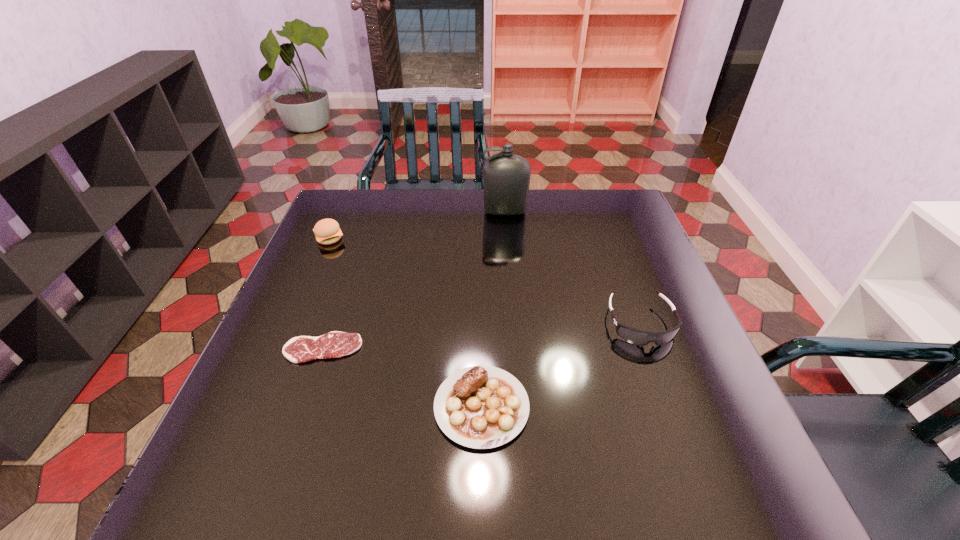
The height and width of the screenshot is (540, 960). I want to click on vacant space positioned 0.090m on the front of the hamburger, so 317,269.

This screenshot has width=960, height=540. I want to click on vacant space located 0.230m on the front and sides of the goggles, so click(687, 448).

Find the location of `blank space located on the left of the second shortest object`. blank space located on the left of the second shortest object is located at coordinates (328, 407).

This screenshot has height=540, width=960. In order to click on free point located 0.240m on the front of the farther steak in this screenshot , I will do `click(279, 475)`.

Image resolution: width=960 pixels, height=540 pixels. I want to click on bottle located at the far edge, so click(x=506, y=177).

Identify the location of hamburger situated at the far edge. This screenshot has height=540, width=960. (327, 231).

The image size is (960, 540). What are the coordinates of `hamburger that is at the left edge` in the screenshot? It's located at (327, 231).

At what (x,y) coordinates should I click in order to perform the action: click on steak that is at the left edge. Please return your answer as a coordinate pair (x, y). The width and height of the screenshot is (960, 540). Looking at the image, I should click on (335, 344).

You are a GUI agent. You are given a task and a screenshot of the screen. Output one action in this format:
    pyautogui.click(x=<x>, y=<y>)
    Task: Click on the object positioned at the right edge
    
    Given the screenshot: What is the action you would take?
    pyautogui.click(x=638, y=337)

Find the location of a particular element. Image resolution: width=960 pixels, height=540 pixels. object situated at the far left corner is located at coordinates (327, 231).